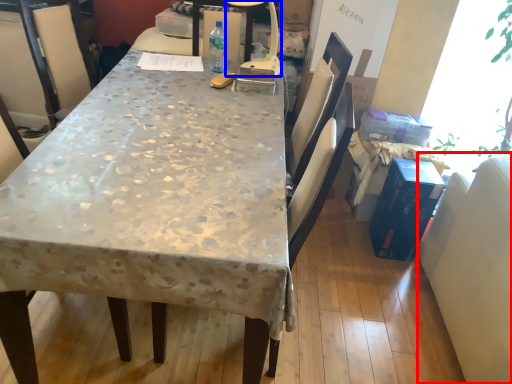
Question: Which object appears farthest to the camera in this image, swivel chair (highlighted by a red box) or lamp (highlighted by a blue box)?

Choices:
 (A) swivel chair
 (B) lamp

Answer: (B)